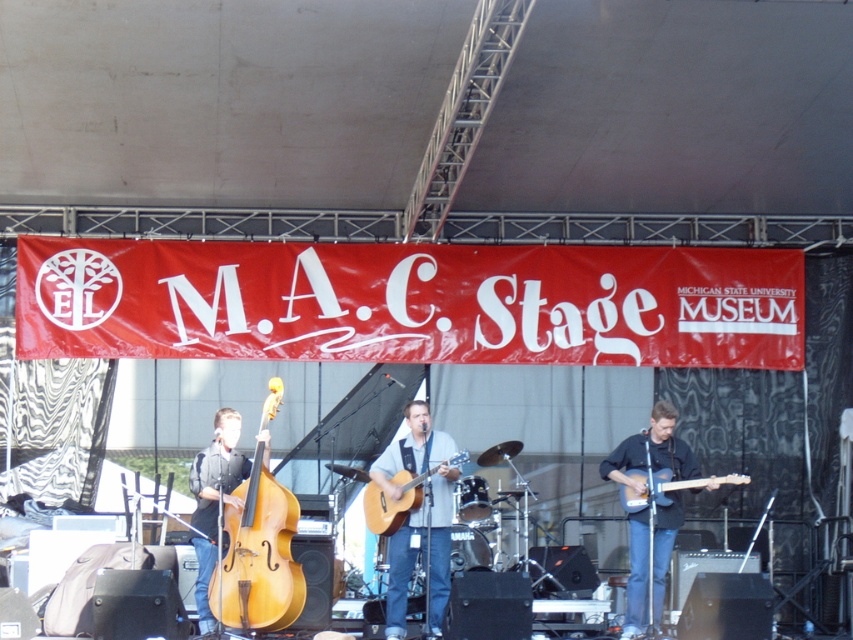
Question: Estimate the real-world distances between objects in this image. Which object is farther from the acoustic wood guitar at center?

Choices:
 (A) light brown wood electric guitar at center
 (B) matte acoustic guitar at center
 (C) dark blue jeans at center

Answer: (A)

Question: Which point is closer to the camera?

Choices:
 (A) (426, 467)
 (B) (393, 637)

Answer: (B)

Question: Can you confirm if matte acoustic guitar at center is positioned to the left of acoustic wood guitar at center?

Choices:
 (A) yes
 (B) no

Answer: (B)

Question: Which of the following is the closest to the observer?

Choices:
 (A) acoustic wood guitar at center
 (B) matte acoustic guitar at center
 (C) dark blue jeans at center

Answer: (B)

Question: Can you confirm if light brown wood cello at center is positioned to the left of acoustic wood guitar at center?

Choices:
 (A) no
 (B) yes

Answer: (B)

Question: Where is matte acoustic guitar at center located in relation to light brown wood electric guitar at center in the image?

Choices:
 (A) below
 (B) above

Answer: (A)